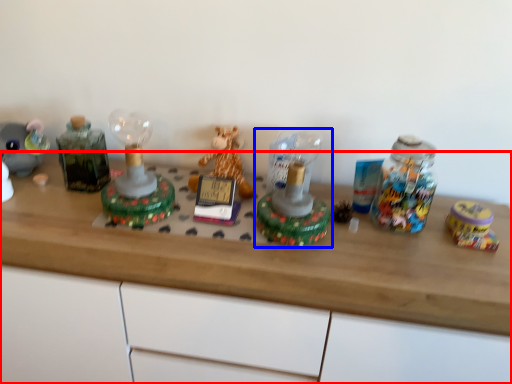
Question: Which object appears closest to the camera in this image, desk (highlighted by a red box) or toy (highlighted by a blue box)?

Choices:
 (A) desk
 (B) toy

Answer: (A)